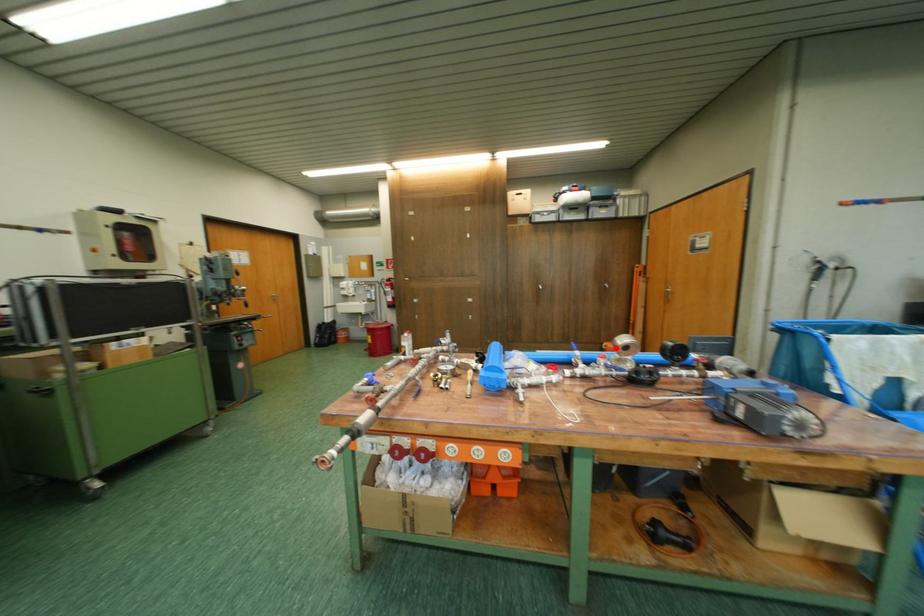
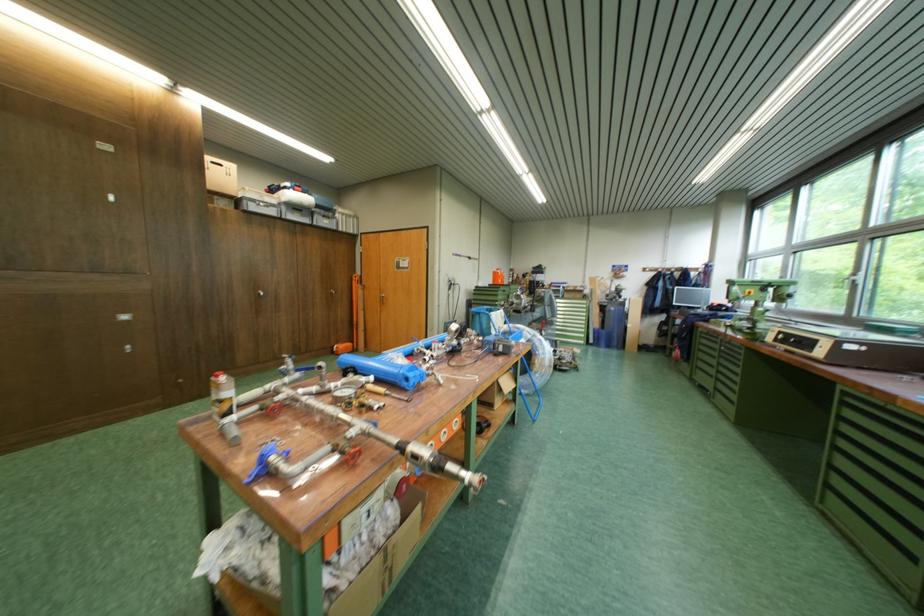
Question: I am providing you with two images of the same scene from different viewpoints. Image1 has a red point marked. In image2, the corresponding 3D location appears at what relative position? Reply with the corresponding letter.

Choices:
 (A) Closer
 (B) Farther

Answer: (A)